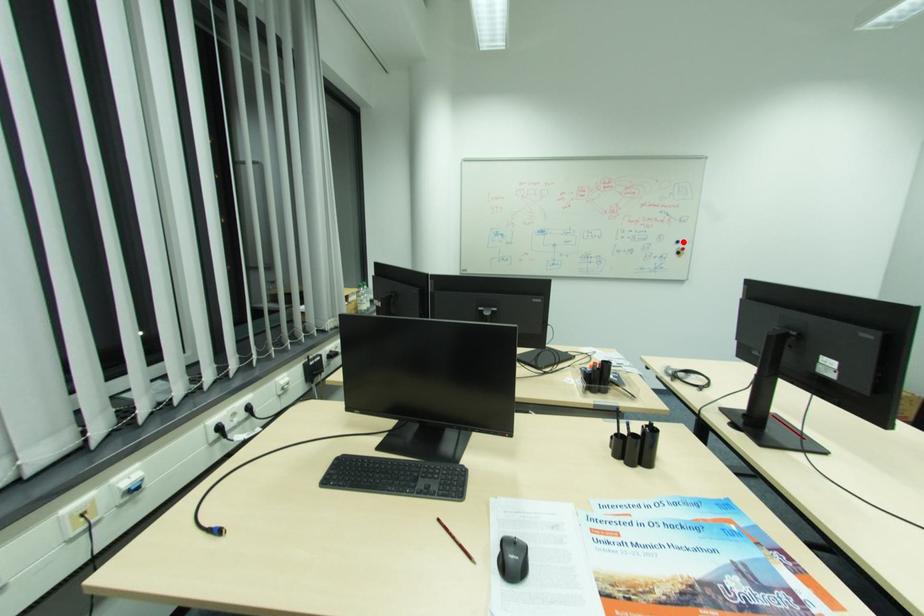
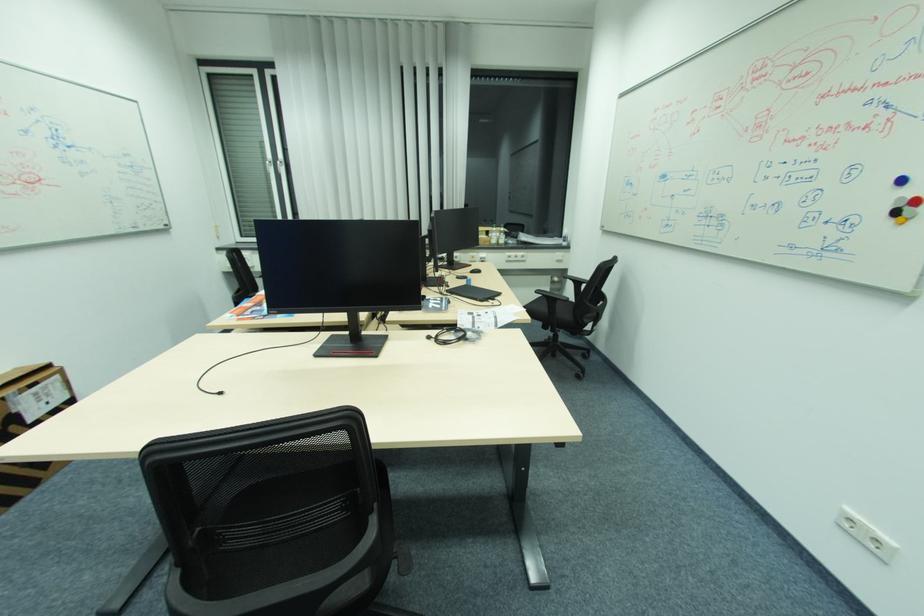
Question: I am providing you with two images of the same scene from different viewpoints. Image1 has a red point marked. In image2, the corresponding 3D location appears at what relative position? Reply with the corresponding letter.

Choices:
 (A) Closer
 (B) Farther

Answer: (B)